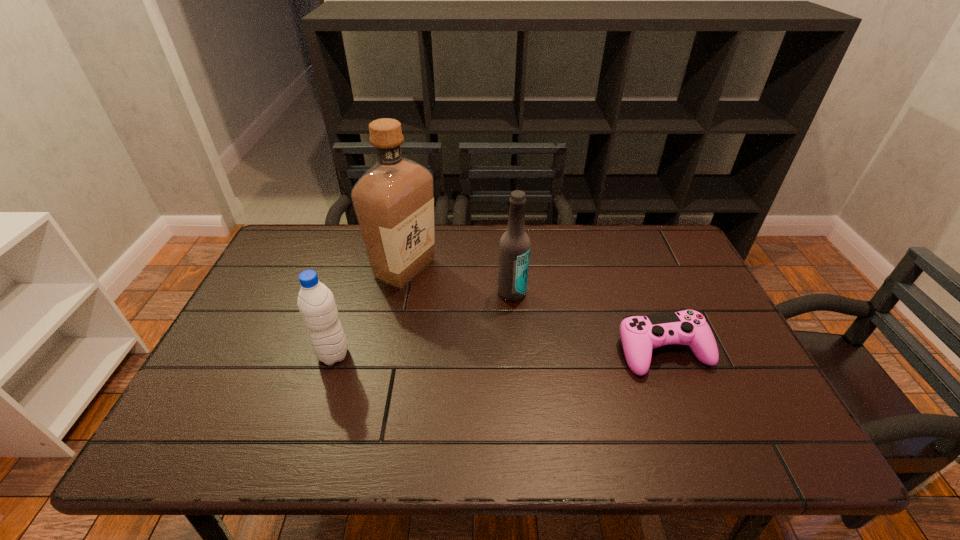
Find the location of `vacant space at the far left corner`. vacant space at the far left corner is located at coordinates (290, 242).

The height and width of the screenshot is (540, 960). Identify the location of vacant space at the far right corner. pyautogui.click(x=671, y=252).

Locate an element on the screen. This screenshot has height=540, width=960. free space at the near right corner of the desktop is located at coordinates (715, 388).

This screenshot has width=960, height=540. Identify the location of empty space between the water bottle and the tallest object. (369, 312).

Where is `unoccupied position between the liquor and the water bottle`? unoccupied position between the liquor and the water bottle is located at coordinates (369, 312).

The height and width of the screenshot is (540, 960). Find the location of `unoccupied area between the beer bottle and the shortest object`. unoccupied area between the beer bottle and the shortest object is located at coordinates (588, 322).

I want to click on free space between the third tallest object and the third shortest object, so click(422, 324).

Where is `free area in between the water bottle and the control`? The height and width of the screenshot is (540, 960). free area in between the water bottle and the control is located at coordinates (498, 353).

Where is `vacant space that's between the third object from left to right and the tallest object`? This screenshot has width=960, height=540. vacant space that's between the third object from left to right and the tallest object is located at coordinates (458, 281).

Identify the location of vacant space that's between the third shortest object and the third tallest object. (422, 324).